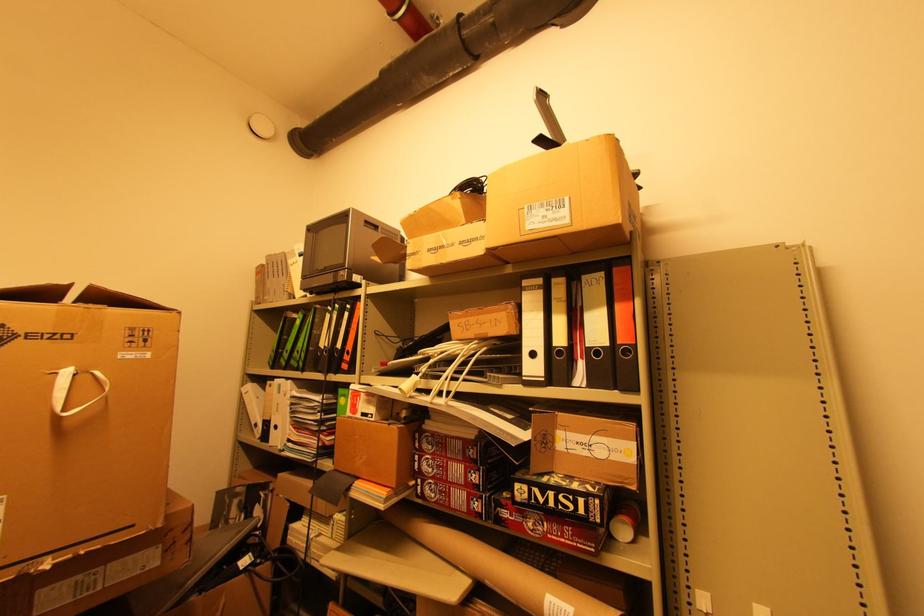
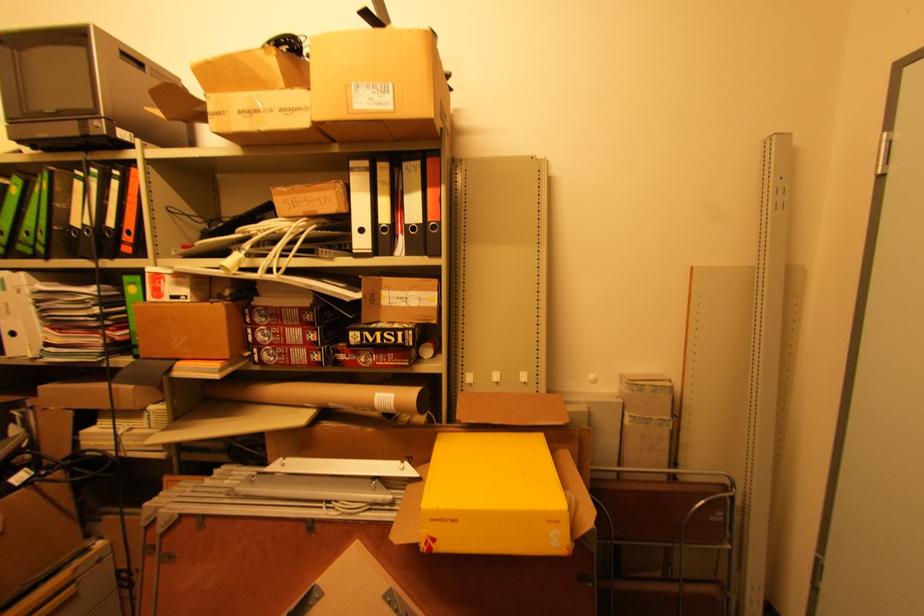
The point at (532, 228) is marked in the first image. Where is the corresponding point in the second image?

(359, 107)